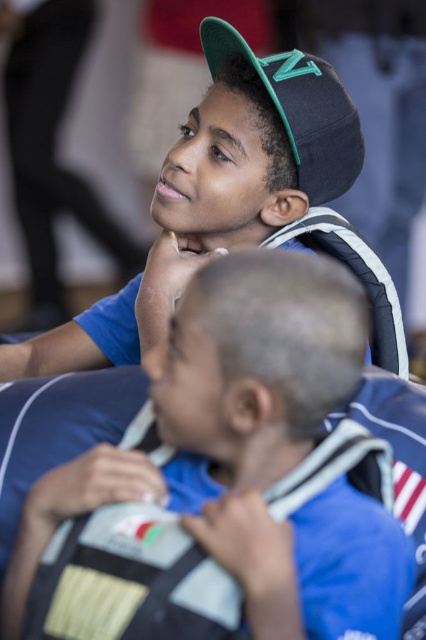
You are trying to determine who is closer to you between the blue fabric shirt at center and the black matte baseball cap at upper center. Based on the scene description, which object is closer?

The blue fabric shirt at center is closer to you because it is described as being in front of the black matte baseball cap at upper center.

You are trying to decide between two hats displayed in a store window. The matte black cap at upper center and the black matte baseball cap at upper center. According to the description, which one has a wider brim?

The matte black cap at upper center has a wider brim than the black matte baseball cap at upper center based on the description provided.

You are an observer standing in front of the image. You notice the blue fabric shirt at center and the matte black cap at upper center. Which object takes up more area in the image?

The matte black cap at upper center occupies more area than the blue fabric shirt at center because the blue fabric shirt at center occupies less space than matte black cap at upper center.